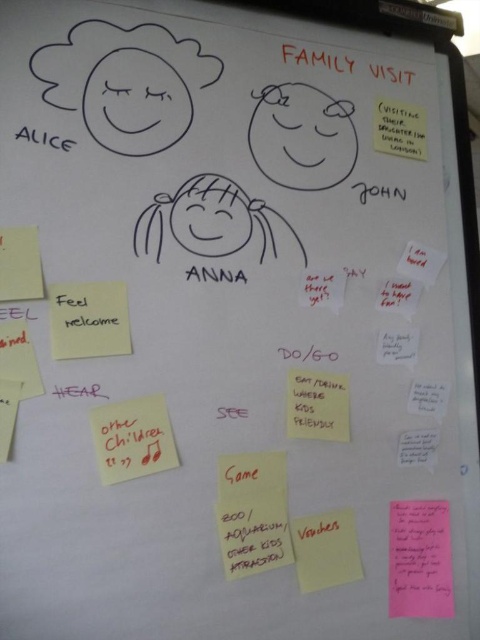
Question: Which point is farther to the camera?

Choices:
 (A) (444, 385)
 (B) (388, 600)
 (C) (307, 372)
 (D) (69, 328)

Answer: (A)

Question: Which object is closer to the camera taking this photo?

Choices:
 (A) white paper note at lower right
 (B) white paper note at right
 (C) pink paper note at center

Answer: (C)

Question: Does pink paper note at lower right appear under white paper note at lower right?

Choices:
 (A) no
 (B) yes

Answer: (B)

Question: Does pink paper note at lower right have a lesser width compared to white paper note at lower right?

Choices:
 (A) no
 (B) yes

Answer: (A)

Question: Does pink paper note at lower right have a larger size compared to yellow paper at lower left?

Choices:
 (A) no
 (B) yes

Answer: (B)

Question: Estimate the real-world distances between objects in this image. Which object is farther from the yellow paper at center?

Choices:
 (A) white paper note at right
 (B) white paper note at lower right
 (C) yellow sticky note at left

Answer: (C)